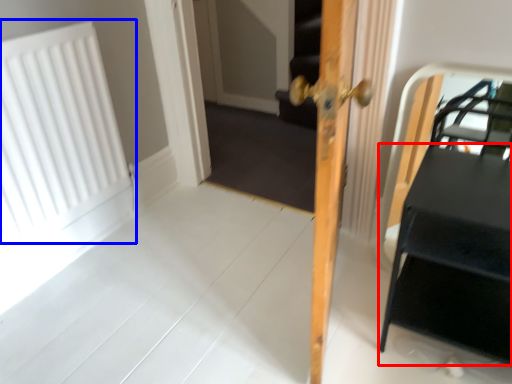
Question: Among these objects, which one is nearest to the camera, table (highlighted by a red box) or radiator (highlighted by a blue box)?

Choices:
 (A) table
 (B) radiator

Answer: (A)